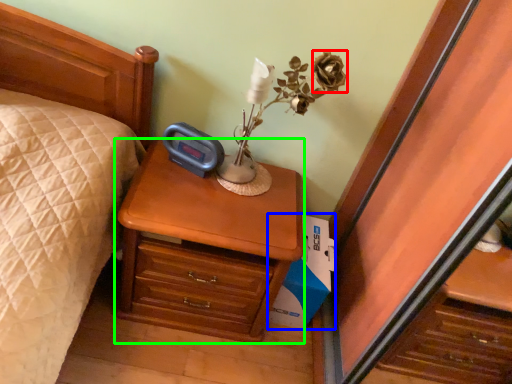
Question: Which object is positioned farthest from flower (highlighted by a red box)? Select from cardboard box (highlighted by a blue box) and nightstand (highlighted by a green box).

Choices:
 (A) cardboard box
 (B) nightstand

Answer: (A)